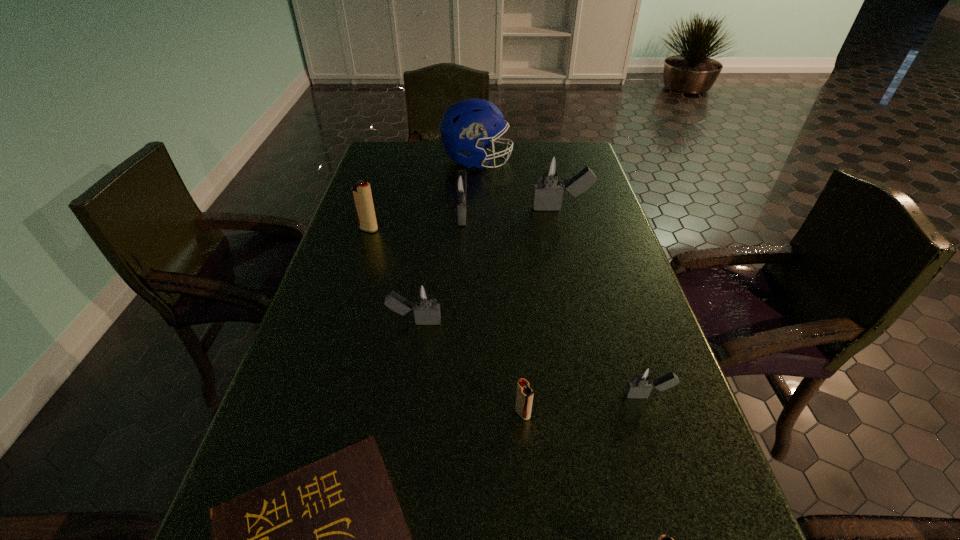
Find the location of a particular element. The width and height of the screenshot is (960, 540). red igniter that stands as the closest to the rightmost red igniter is located at coordinates (524, 397).

The height and width of the screenshot is (540, 960). Identify the location of free space that satisfies the following two spatial constraints: 1. on the front-facing side of the blue football helmet; 2. on the front side of the leftmost red igniter. (476, 229).

Where is `vacant area that satisfies the following two spatial constraints: 1. on the back side of the third smallest gray igniter; 2. on the left side of the fifth farthest object`? Image resolution: width=960 pixels, height=540 pixels. vacant area that satisfies the following two spatial constraints: 1. on the back side of the third smallest gray igniter; 2. on the left side of the fifth farthest object is located at coordinates (431, 212).

The height and width of the screenshot is (540, 960). Identify the location of vacant area in the image that satisfies the following two spatial constraints: 1. on the back side of the farthest red igniter; 2. on the right side of the tallest igniter. (375, 208).

Image resolution: width=960 pixels, height=540 pixels. Find the location of `blank area in the image that satisfies the following two spatial constraints: 1. on the front-facing side of the football helmet; 2. on the front side of the third smallest gray igniter`. blank area in the image that satisfies the following two spatial constraints: 1. on the front-facing side of the football helmet; 2. on the front side of the third smallest gray igniter is located at coordinates (476, 212).

Image resolution: width=960 pixels, height=540 pixels. Find the location of `vacant area that satisfies the following two spatial constraints: 1. on the front-facing side of the tallest igniter; 2. on the left side of the football helmet`. vacant area that satisfies the following two spatial constraints: 1. on the front-facing side of the tallest igniter; 2. on the left side of the football helmet is located at coordinates (476, 208).